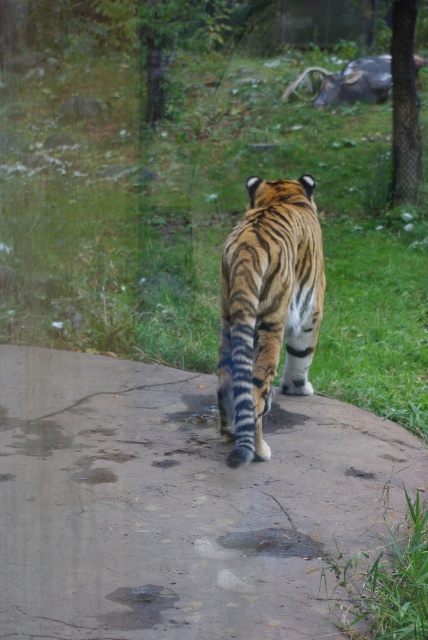
You are a zookeeper who needs to clean the enclosure. You see the concrete wet pavement at center and the gray metallic bull at upper center. Which object is closer to the left side of the enclosure?

The concrete wet pavement at center is to the left of the gray metallic bull at upper center, so it is closer to the left side of the enclosure.

In the scene shown: You are standing in front of the tiger enclosure and see two points marked on the glass barrier. The first point is at coordinate point (181, 353) and the second is at point (329, 531). Which point is closer to you?

Point (181, 353) is further to the camera than point (329, 531). Therefore, point (329, 531) is closer to you.

You are a zookeeper observing the tiger enclosure. You need to determine which area is wider between the green grass at center and the concrete wet pavement at center. Which one is wider?

→ The green grass at center is wider than the concrete wet pavement at center according to the description.